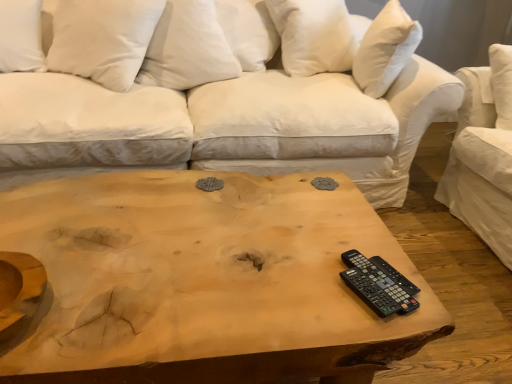
Question: Should I look upward or downward to see white soft pillow at upper right, which appears as the first pillow when viewed from the right?

Choices:
 (A) up
 (B) down

Answer: (A)

Question: Is black plastic remote at lower right oriented towards white cotton studio couch at center?

Choices:
 (A) yes
 (B) no

Answer: (B)

Question: Is black plastic remote at lower right in contact with white cotton studio couch at center?

Choices:
 (A) yes
 (B) no

Answer: (B)

Question: Does black plastic remote at lower right have a lesser width compared to white cotton studio couch at center?

Choices:
 (A) yes
 (B) no

Answer: (A)

Question: Would you say black plastic remote at lower right is a long distance from white cotton studio couch at center?

Choices:
 (A) yes
 (B) no

Answer: (A)

Question: Considering the relative sizes of black plastic remote at lower right and white cotton studio couch at center in the image provided, is black plastic remote at lower right wider than white cotton studio couch at center?

Choices:
 (A) yes
 (B) no

Answer: (B)

Question: Does black plastic remote at lower right come in front of white cotton studio couch at center?

Choices:
 (A) yes
 (B) no

Answer: (A)

Question: Is black plastic remote at lower right shorter than natural wood coffee table at center?

Choices:
 (A) yes
 (B) no

Answer: (A)

Question: Is black plastic remote at lower right wider than natural wood coffee table at center?

Choices:
 (A) yes
 (B) no

Answer: (B)

Question: From the image's perspective, is black plastic remote at lower right located beneath natural wood coffee table at center?

Choices:
 (A) yes
 (B) no

Answer: (B)

Question: Is natural wood coffee table at center located within black plastic remote at lower right?

Choices:
 (A) no
 (B) yes

Answer: (A)

Question: From a real-world perspective, is black plastic remote at lower right on natural wood coffee table at center?

Choices:
 (A) yes
 (B) no

Answer: (A)

Question: Is black plastic remote at lower right positioned before natural wood coffee table at center?

Choices:
 (A) no
 (B) yes

Answer: (A)

Question: Is white cotton pillow at upper center, the third pillow from the left, looking in the opposite direction of white cotton studio couch at center?

Choices:
 (A) yes
 (B) no

Answer: (A)